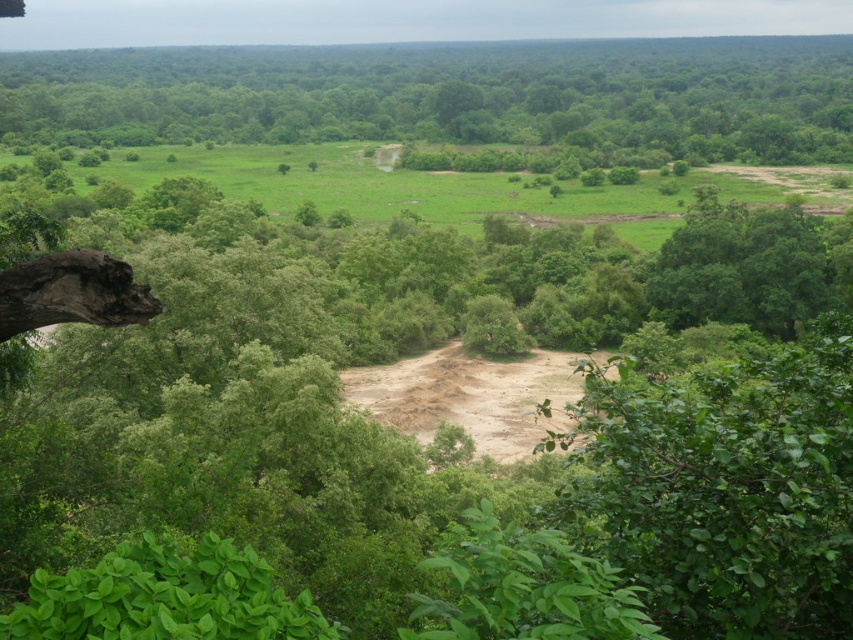
Question: Does green leafy tree at upper left come behind brown sandy dirt track at center?

Choices:
 (A) yes
 (B) no

Answer: (A)

Question: Which object is closer to the camera taking this photo?

Choices:
 (A) brown sandy dirt track at center
 (B) green leafy tree at upper left

Answer: (A)

Question: Which object is farther from the camera taking this photo?

Choices:
 (A) green leafy tree at upper left
 (B) brown sandy dirt track at center

Answer: (A)

Question: Is green leafy tree at upper left above brown sandy dirt track at center?

Choices:
 (A) yes
 (B) no

Answer: (A)

Question: Considering the relative positions of green leafy tree at upper left and brown sandy dirt track at center in the image provided, where is green leafy tree at upper left located with respect to brown sandy dirt track at center?

Choices:
 (A) below
 (B) above

Answer: (B)